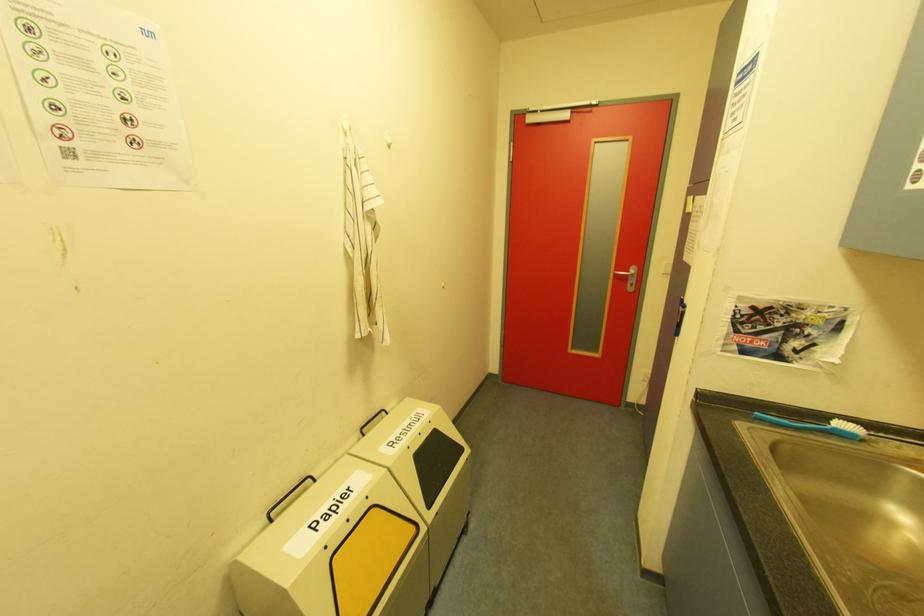
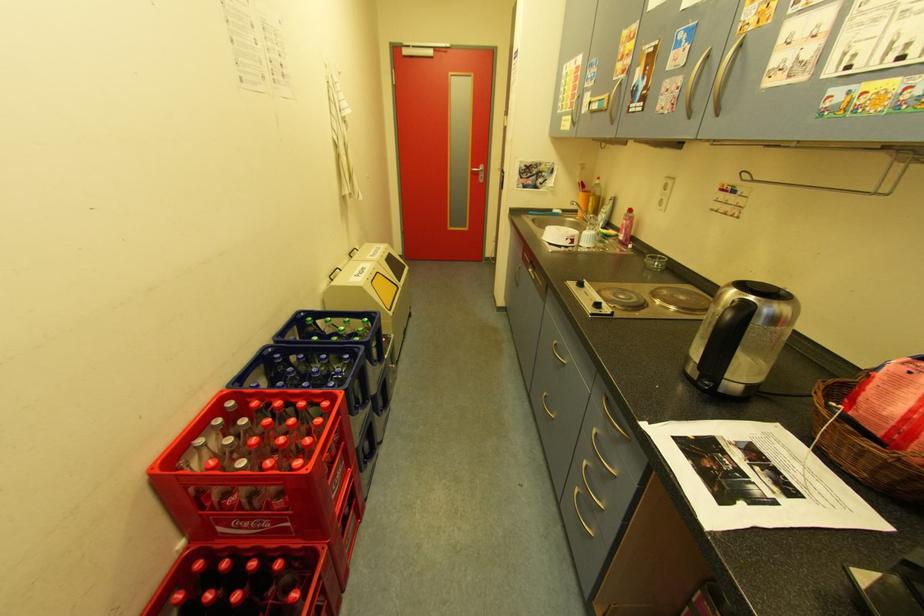
The images are taken continuously from a first-person perspective. In which direction are you moving?

The cameraman walked toward left, backward.